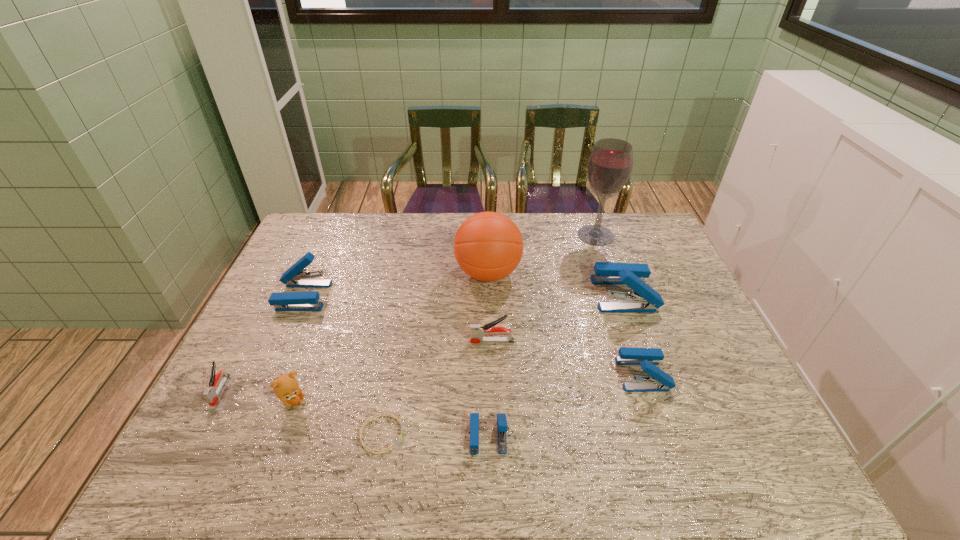
This screenshot has width=960, height=540. What are the coordinates of `the farthest object` in the screenshot? It's located at (610, 164).

This screenshot has width=960, height=540. I want to click on alcohol, so click(610, 164).

The width and height of the screenshot is (960, 540). I want to click on the ninth shortest object, so click(488, 246).

Identify the location of basketball. The width and height of the screenshot is (960, 540). (488, 246).

At what (x,y) coordinates should I click in order to perform the action: click on the biggest blue stapler. Please return your answer as a coordinate pair (x, y). Looking at the image, I should click on pos(644,299).

Identify the location of the third tallest object. The image size is (960, 540). click(x=644, y=299).

Image resolution: width=960 pixels, height=540 pixels. In order to click on the second stapler from left to right in this screenshot , I will do `click(295, 277)`.

Where is `the third smallest blue stapler`? This screenshot has height=540, width=960. the third smallest blue stapler is located at coordinates (295, 277).

I want to click on the right gray stapler, so click(477, 331).

At what (x,y) coordinates should I click in order to perform the action: click on the bigger gray stapler. Please return your answer as a coordinate pair (x, y). This screenshot has width=960, height=540. Looking at the image, I should click on (477, 331).